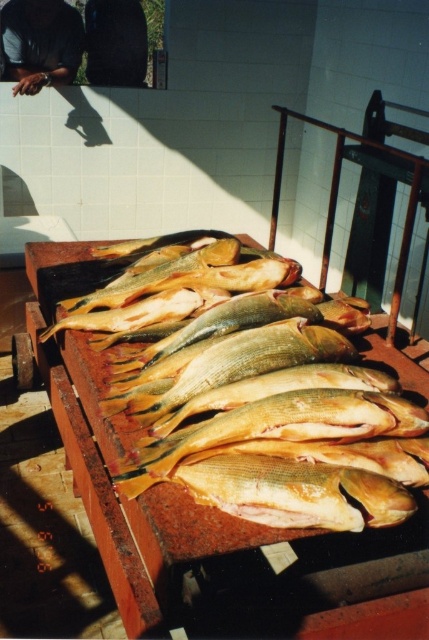
Can you confirm if yellowish wood table at center is wider than dark skin smooth hand at upper left?

Indeed, yellowish wood table at center has a greater width compared to dark skin smooth hand at upper left.

Between yellowish wood table at center and dark skin smooth hand at upper left, which one appears on the right side from the viewer's perspective?

From the viewer's perspective, yellowish wood table at center appears more on the right side.

Measure the distance between yellowish wood table at center and camera.

They are 1.25 meters apart.

This screenshot has height=640, width=429. I want to click on yellowish wood table at center, so click(x=102, y=483).